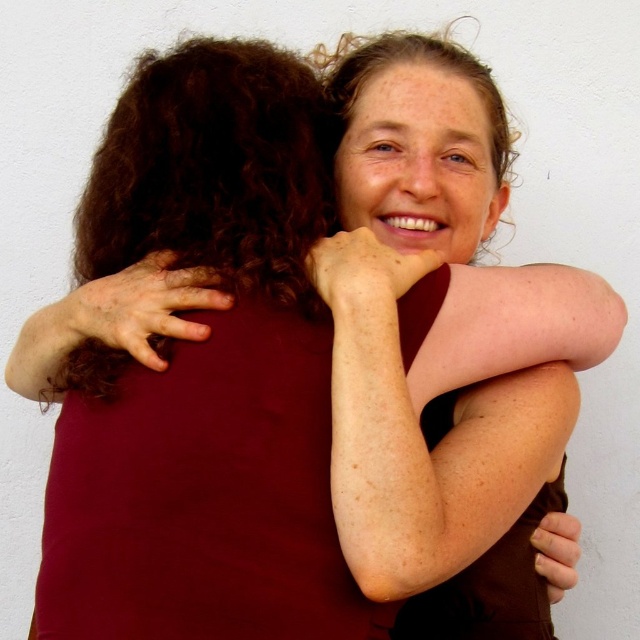
You are standing in front of the image and want to touch the point that is closer to you between the two points labeled point (358,404) and point (56,323). Which point should you choose?

You should choose point (358,404) because it is closer to the viewer than point (56,323).

You are a physical therapist assessing the space between two body parts in the image. The smooth skin arm at center and the dry skin at left are both visible. Can a 10.5 inch long medical tool be placed between them without touching either?

The distance between the smooth skin arm at center and the dry skin at left is 10.44 inches. Since the medical tool is 10.5 inches long, it would be slightly too long to fit between them without touching either.

You are a skincare specialist observing the image. You notice the smooth skin arm at center and the dry skin at left. Which of these two areas would you recommend applying a moisturizer to based on their condition?

→ The dry skin at left requires moisturizer as it has a dry condition, while the smooth skin arm at center appears well hydrated.